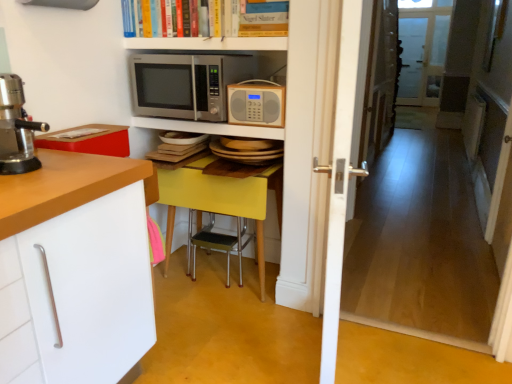
Question: Does point (184, 178) appear closer or farther from the camera than point (460, 256)?

Choices:
 (A) farther
 (B) closer

Answer: (B)

Question: From a real-world perspective, is yellow matte table at center positioned above or below wooden floor at center?

Choices:
 (A) above
 (B) below

Answer: (B)

Question: Which is farther from the white glossy shelf at upper center, which is counted as the 1th shelf, starting from the top?

Choices:
 (A) wooden radio at center, arranged as the 2th microwave oven when viewed from the left
 (B) transparent glass screen door at upper right
 (C) yellow matte table at center
 (D) hardcover book at upper center
 (E) wooden floor at center

Answer: (B)

Question: Which of these objects is positioned farthest from the yellow matte table at center?

Choices:
 (A) wooden floor at center
 (B) metallic silver microwave at upper center, the 1th shelf from the bottom
 (C) white glossy shelf at upper center, which is counted as the 1th shelf, starting from the top
 (D) transparent glass screen door at upper right
 (E) wooden radio at center, placed as the 1th microwave oven when sorted from right to left

Answer: (D)